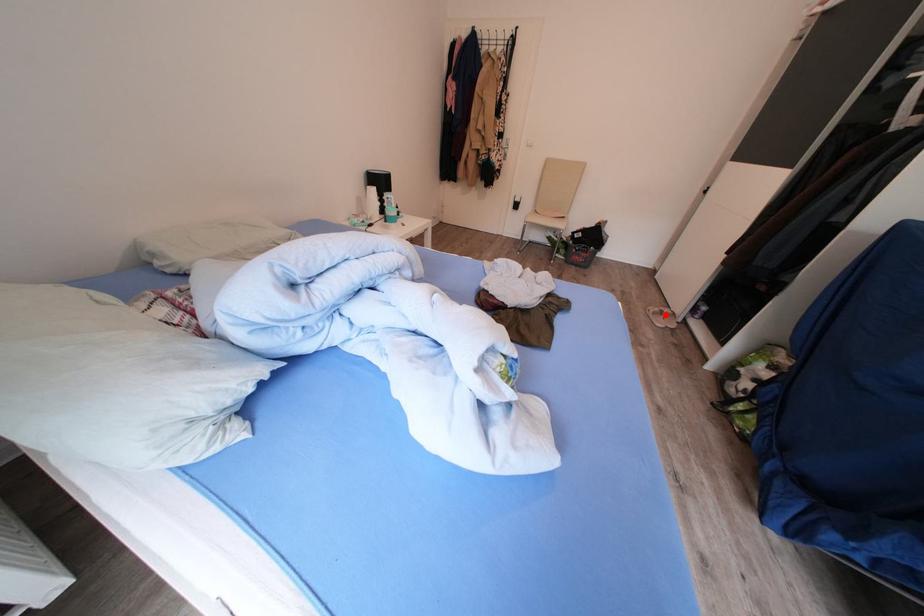
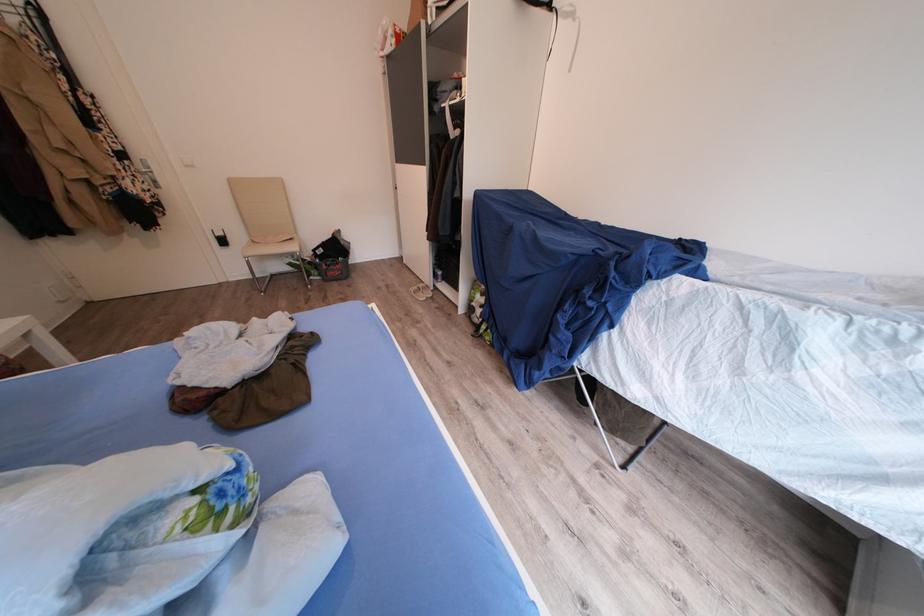
Question: I am providing you with two images of the same scene from different viewpoints. Image1 has a red point marked. In image2, the corresponding 3D location appears at what relative position? Reply with the corresponding letter.

Choices:
 (A) Closer
 (B) Farther

Answer: (A)